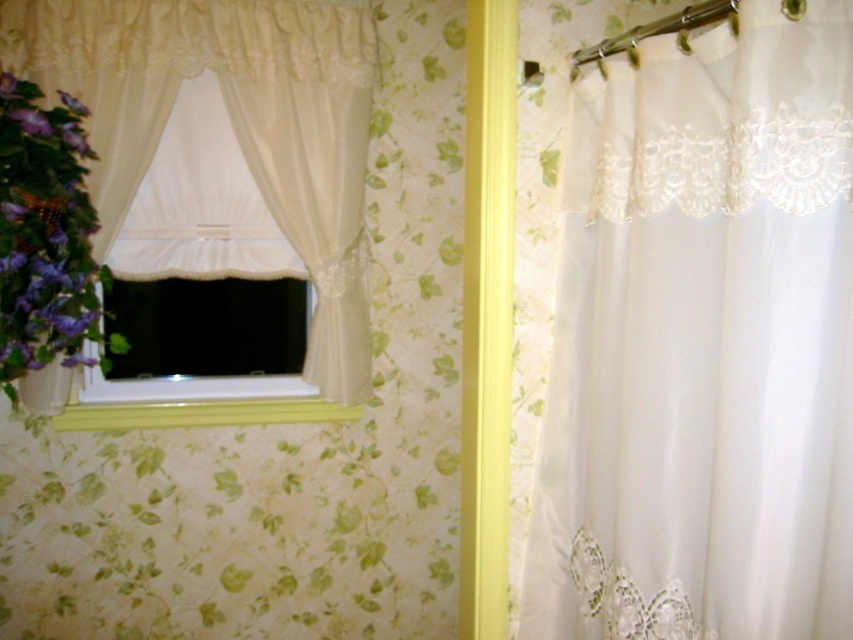
Question: Based on their relative distances, which object is nearer to the purple matte flower at left?

Choices:
 (A) yellow painted wood at lower center
 (B) white sheer fabric at right

Answer: (A)

Question: Estimate the real-world distances between objects in this image. Which object is closer to the yellow painted wood at lower center?

Choices:
 (A) white lace curtain at left
 (B) purple matte flower at left

Answer: (B)

Question: Is the position of white lace curtain at left more distant than that of yellow painted wood at lower center?

Choices:
 (A) no
 (B) yes

Answer: (A)

Question: Does white sheer fabric at right come behind white lace curtain at left?

Choices:
 (A) yes
 (B) no

Answer: (B)

Question: Among these objects, which one is farthest from the camera?

Choices:
 (A) yellow painted wood at lower center
 (B) white sheer fabric at right

Answer: (A)

Question: Is purple matte flower at left thinner than yellow painted wood at lower center?

Choices:
 (A) yes
 (B) no

Answer: (A)